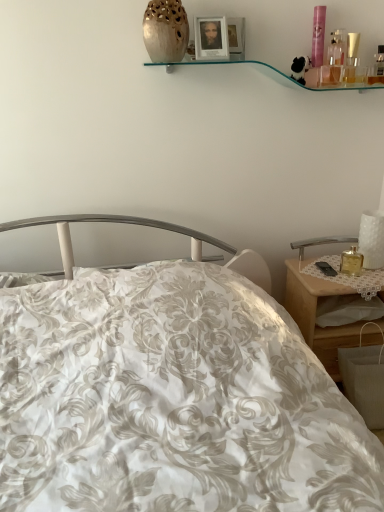
Question: Is wooden nightstand at right with matte wooden picture frame at upper center?

Choices:
 (A) yes
 (B) no

Answer: (B)

Question: Is wooden nightstand at right smaller than matte wooden picture frame at upper center?

Choices:
 (A) no
 (B) yes

Answer: (A)

Question: Considering the relative sizes of wooden nightstand at right and matte wooden picture frame at upper center in the image provided, is wooden nightstand at right thinner than matte wooden picture frame at upper center?

Choices:
 (A) yes
 (B) no

Answer: (B)

Question: Does wooden nightstand at right appear on the left side of matte wooden picture frame at upper center?

Choices:
 (A) yes
 (B) no

Answer: (B)

Question: Is wooden nightstand at right oriented towards matte wooden picture frame at upper center?

Choices:
 (A) yes
 (B) no

Answer: (B)

Question: Is wooden nightstand at right closer to camera compared to matte wooden picture frame at upper center?

Choices:
 (A) yes
 (B) no

Answer: (B)

Question: Is matte wooden picture frame at upper center to the left of matte beige vase at upper center from the viewer's perspective?

Choices:
 (A) no
 (B) yes

Answer: (A)

Question: From a real-world perspective, is matte wooden picture frame at upper center beneath matte beige vase at upper center?

Choices:
 (A) no
 (B) yes

Answer: (B)

Question: From the image's perspective, does matte wooden picture frame at upper center appear lower than matte beige vase at upper center?

Choices:
 (A) yes
 (B) no

Answer: (A)

Question: Is matte wooden picture frame at upper center positioned in front of matte beige vase at upper center?

Choices:
 (A) yes
 (B) no

Answer: (B)

Question: Does matte wooden picture frame at upper center have a larger size compared to matte beige vase at upper center?

Choices:
 (A) no
 (B) yes

Answer: (A)

Question: Does matte wooden picture frame at upper center have a lesser height compared to matte beige vase at upper center?

Choices:
 (A) no
 (B) yes

Answer: (B)

Question: Does matte beige vase at upper center have a larger size compared to wooden nightstand at right?

Choices:
 (A) no
 (B) yes

Answer: (A)